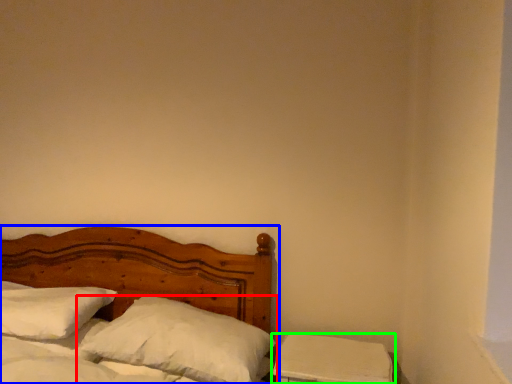
Question: Which object is positioned closest to pillow (highlighted by a red box)? Select from bed (highlighted by a blue box) and nightstand (highlighted by a green box).

Choices:
 (A) bed
 (B) nightstand

Answer: (B)